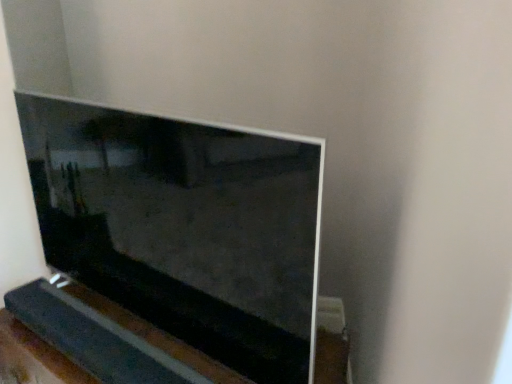
Measure the distance between point (130, 365) and camera.

The depth of point (130, 365) is 1.08 meters.

Image resolution: width=512 pixels, height=384 pixels. What do you see at coordinates (110, 338) in the screenshot?
I see `black wood at lower left` at bounding box center [110, 338].

I want to click on black wood at lower left, so click(x=110, y=338).

Where is `matte black television at center`? The height and width of the screenshot is (384, 512). matte black television at center is located at coordinates (184, 226).

The image size is (512, 384). What do you see at coordinates (184, 226) in the screenshot? I see `matte black television at center` at bounding box center [184, 226].

Find the location of a particular element. black wood at lower left is located at coordinates (110, 338).

In the image, is black wood at lower left on the left side or the right side of matte black television at center?

black wood at lower left is to the left of matte black television at center.

From the picture: Does black wood at lower left lie behind matte black television at center?

Yes, the depth of black wood at lower left is greater than that of matte black television at center.

Which point is more forward, (168,351) or (212,170)?

Point (212,170)

From the picture: From the image's perspective, which object appears higher, black wood at lower left or matte black television at center?

matte black television at center appears higher in the image.

From a real-world perspective, who is located higher, black wood at lower left or matte black television at center?

From a 3D spatial view, matte black television at center is above.

Considering the relative sizes of black wood at lower left and matte black television at center in the image provided, is black wood at lower left thinner than matte black television at center?

Correct, the width of black wood at lower left is less than that of matte black television at center.

Can you confirm if black wood at lower left is taller than matte black television at center?

Incorrect, the height of black wood at lower left is not larger of that of matte black television at center.

Can you confirm if black wood at lower left is smaller than matte black television at center?

Indeed, black wood at lower left has a smaller size compared to matte black television at center.

Could matte black television at center be considered to be inside black wood at lower left?

Actually, matte black television at center is outside black wood at lower left.

Is black wood at lower left far away from matte black television at center?

black wood at lower left is actually quite close to matte black television at center.

Is black wood at lower left facing away from matte black television at center?

Yes.

The width and height of the screenshot is (512, 384). Find the location of `television in front of the black wood at lower left`. television in front of the black wood at lower left is located at coordinates (184, 226).

Would you say matte black television at center is to the left or to the right of black wood at lower left in the picture?

Based on their positions, matte black television at center is located to the right of black wood at lower left.

Is matte black television at center further to the viewer compared to black wood at lower left?

No, matte black television at center is closer to the camera.

Is point (26, 124) closer to viewer compared to point (211, 366)?

No, it is not.

From the image's perspective, is matte black television at center below black wood at lower left?

Incorrect, from the image's perspective, matte black television at center is higher than black wood at lower left.

From a real-world perspective, is matte black television at center below black wood at lower left?

No.

Considering the sizes of matte black television at center and black wood at lower left in the image, is matte black television at center wider or thinner than black wood at lower left?

In the image, matte black television at center appears to be wider than black wood at lower left.

Which of these two, matte black television at center or black wood at lower left, stands shorter?

With less height is black wood at lower left.

Considering the relative sizes of matte black television at center and black wood at lower left in the image provided, is matte black television at center bigger than black wood at lower left?

Yes, matte black television at center is bigger than black wood at lower left.

Is matte black television at center positioned beyond the bounds of black wood at lower left?

That's correct, matte black television at center is outside of black wood at lower left.

Are matte black television at center and black wood at lower left making contact?

No.

Is matte black television at center facing away from black wood at lower left?

That's not correct — matte black television at center is not looking away from black wood at lower left.

Consider the image. Can you tell me how much matte black television at center and black wood at lower left differ in facing direction?

0.00226 degrees.

Image resolution: width=512 pixels, height=384 pixels. I want to click on ledge on the left of matte black television at center, so click(x=110, y=338).

The image size is (512, 384). I want to click on television that appears in front of the black wood at lower left, so click(x=184, y=226).

Where is `ledge behind the matte black television at center`? This screenshot has height=384, width=512. ledge behind the matte black television at center is located at coordinates (110, 338).